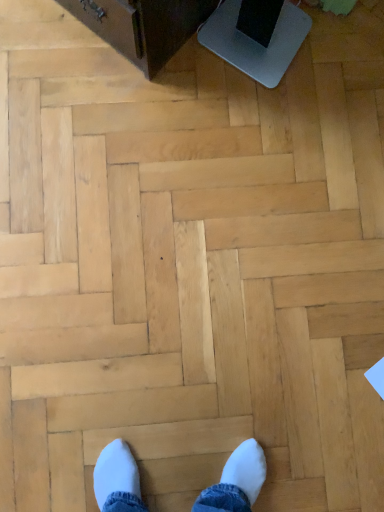
This screenshot has height=512, width=384. I want to click on silver metallic laptop at upper center, so click(x=256, y=42).

What do you see at coordinates (256, 42) in the screenshot? The width and height of the screenshot is (384, 512). I see `silver metallic laptop at upper center` at bounding box center [256, 42].

Identify the location of silver metallic laptop at upper center. (256, 42).